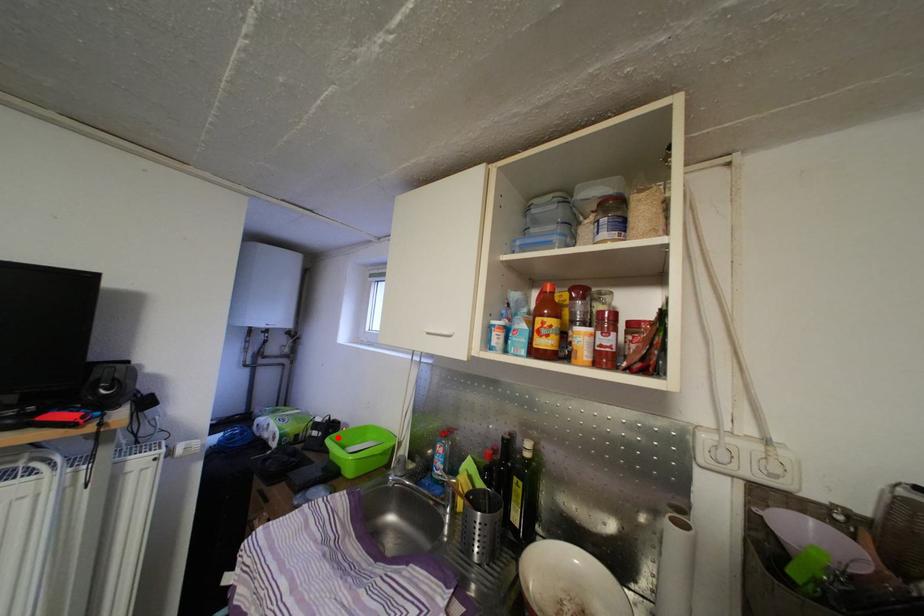
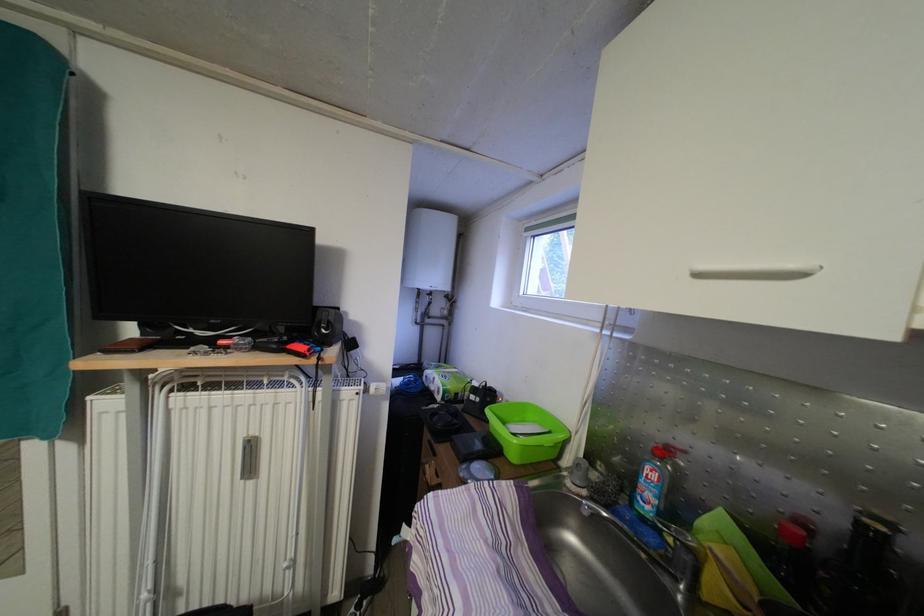
In the second image, find the point that corresponds to the highlighted location in the first image.

(495, 406)